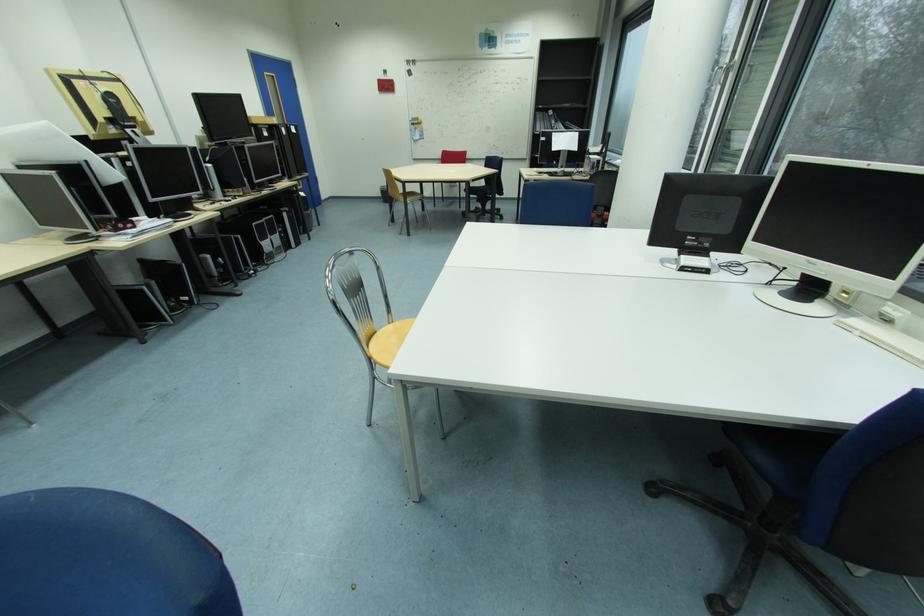
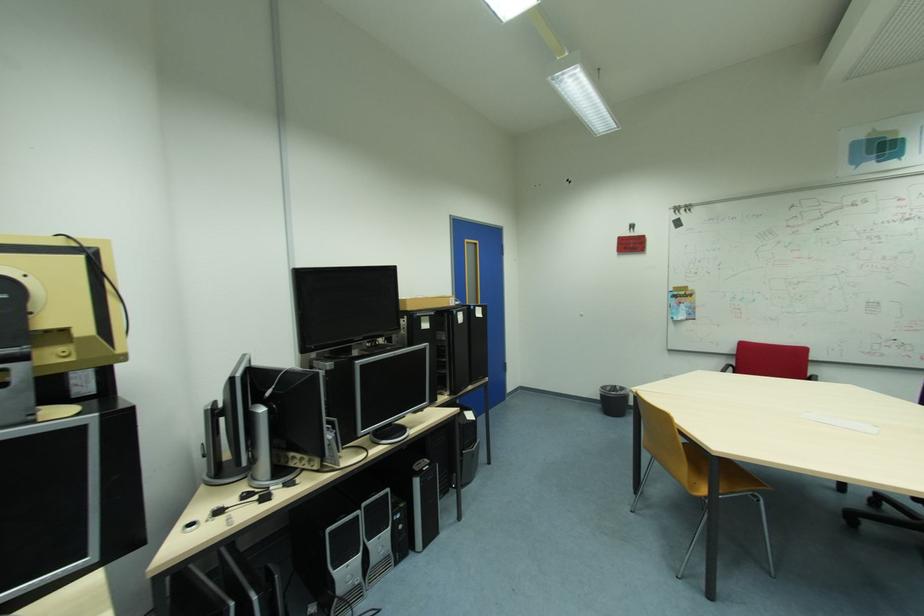
The point at (x=116, y=77) is marked in the first image. Where is the corresponding point in the second image?

(66, 244)